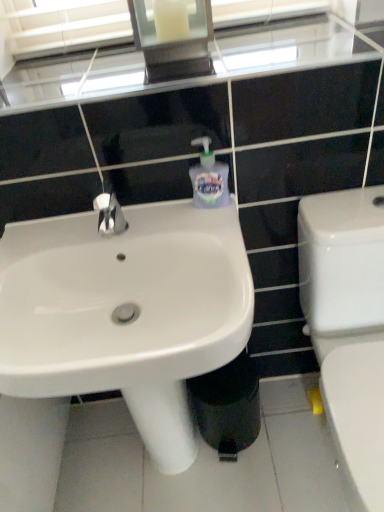
What are the coordinates of `free location to the right of black plastic trash bin/can at lower center` in the screenshot? It's located at (283, 432).